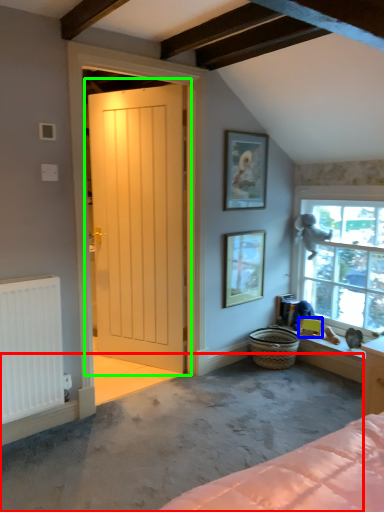
Question: Which object is the closest to the concrete (highlighted by a red box)? Choose among these: picture frame (highlighted by a blue box) or door (highlighted by a green box).

Choices:
 (A) picture frame
 (B) door

Answer: (B)